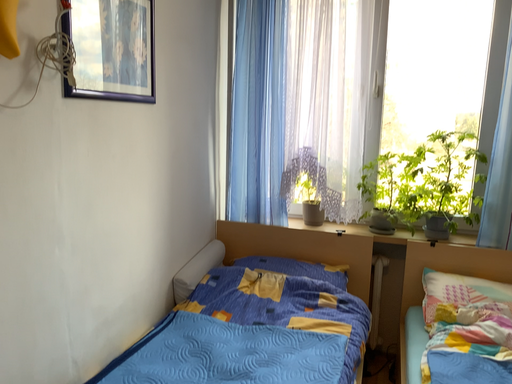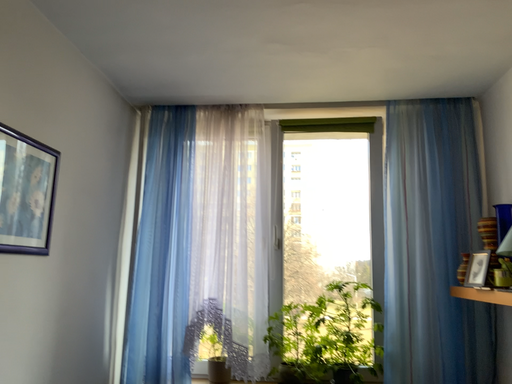
Question: Which way did the camera rotate in the video?

Choices:
 (A) rotated left
 (B) rotated right

Answer: (B)